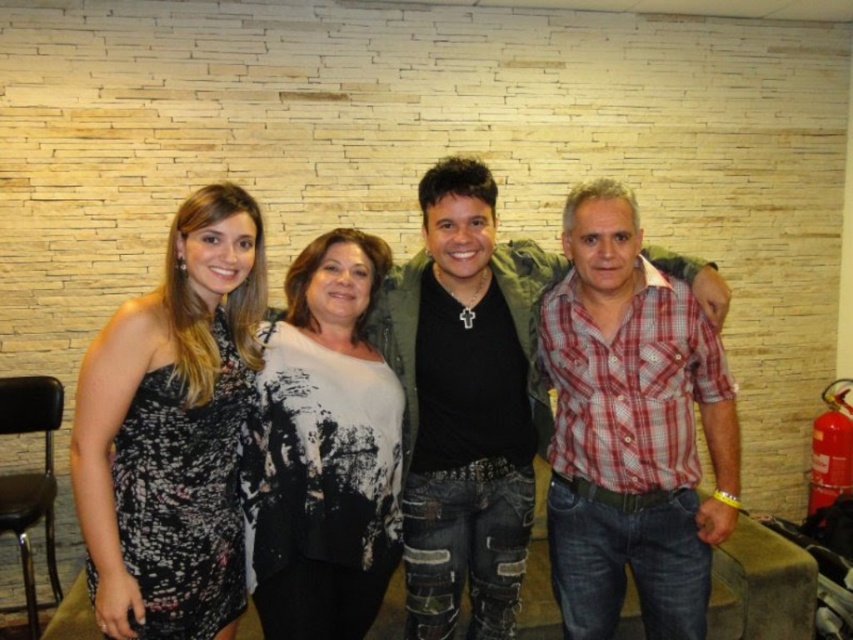
You are a photographer setting up for a group photo. You notice the black satin dress at left and the white textured sweater at center. Which clothing item will require more space in the frame to ensure it is fully captured?

The black satin dress at left is bigger than the white textured sweater at center, so it will require more space in the frame to ensure it is fully captured.

You are standing in front of the group photo and want to locate the black satin dress at left. According to the coordinates provided, where exactly would you look on the image to find it?

The black satin dress at left is located at the coordinates point [172,429].

You are a photographer trying to capture a closeup of the red plaid shirt at center and the white textured sweater at center. Which of the two should you focus on first if you want to ensure both are in focus, considering their sizes?

The red plaid shirt at center is bigger than the white textured sweater at center, so you should focus on the red plaid shirt at center first to ensure both are in focus.